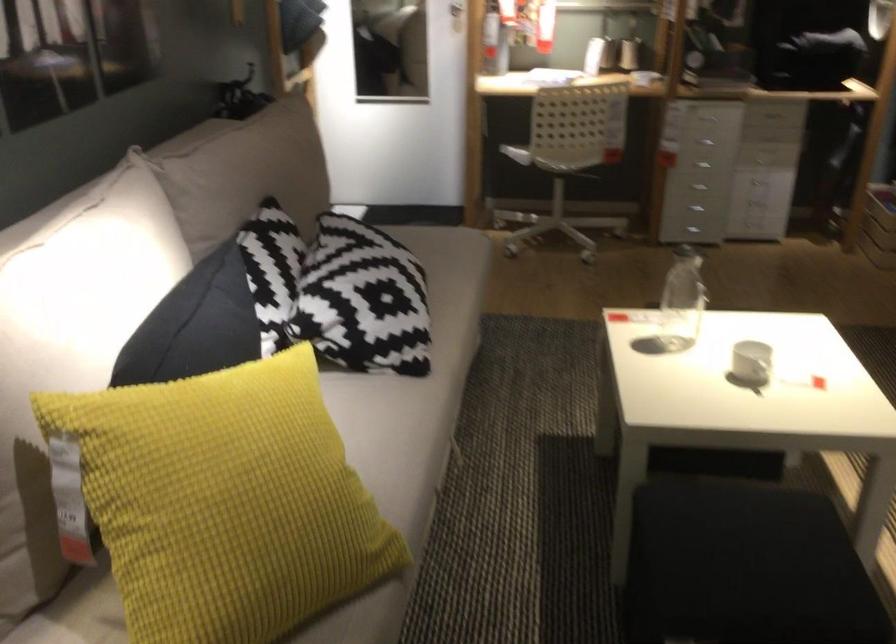
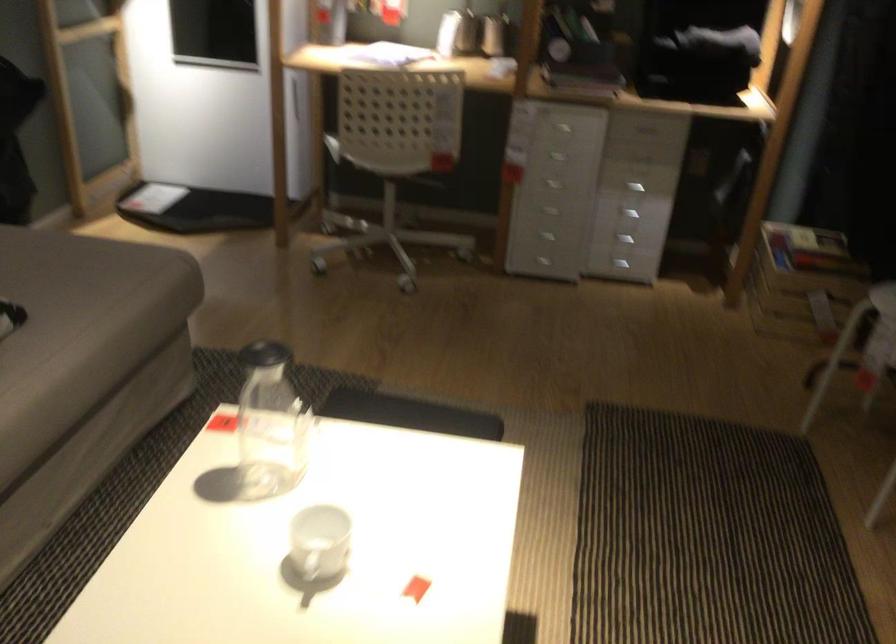
Locate, in the second image, the point that corresponds to point 780,147 in the first image.

(634, 187)